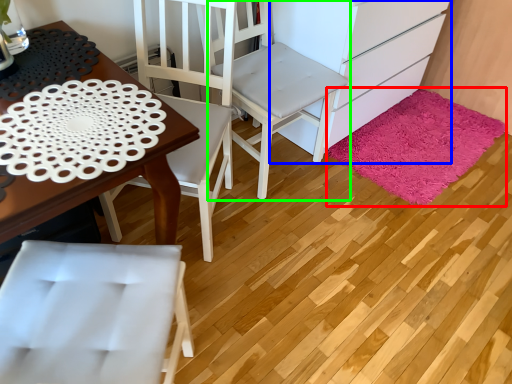
Question: Estimate the real-world distances between objects in this image. Which object is farther from mat (highlighted by a red box), cabinetry (highlighted by a blue box) or chair (highlighted by a green box)?

Choices:
 (A) cabinetry
 (B) chair

Answer: (B)